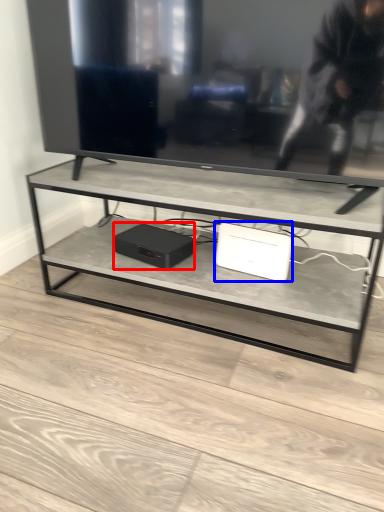
Question: Among these objects, which one is farthest to the camera, computer (highlighted by a red box) or computer (highlighted by a blue box)?

Choices:
 (A) computer
 (B) computer

Answer: (A)